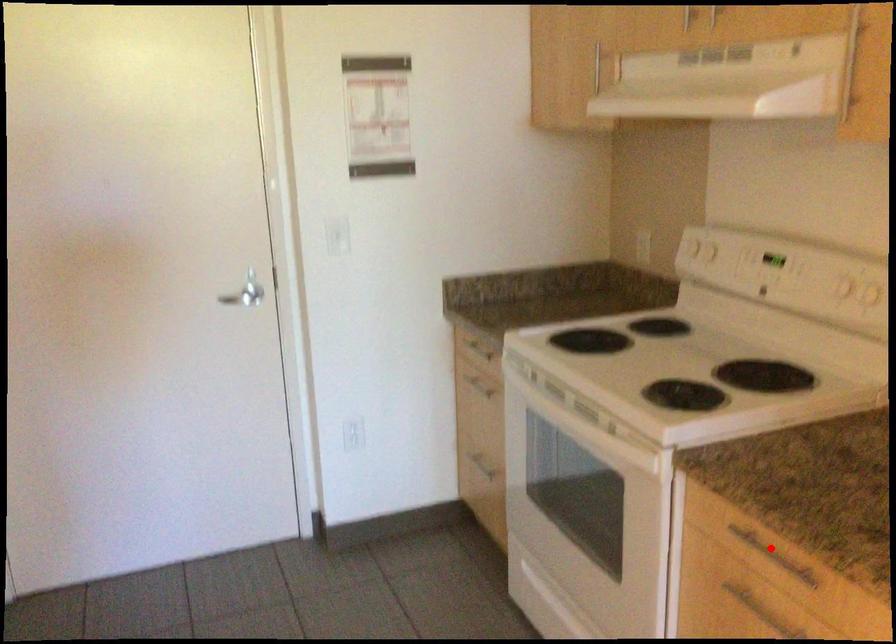
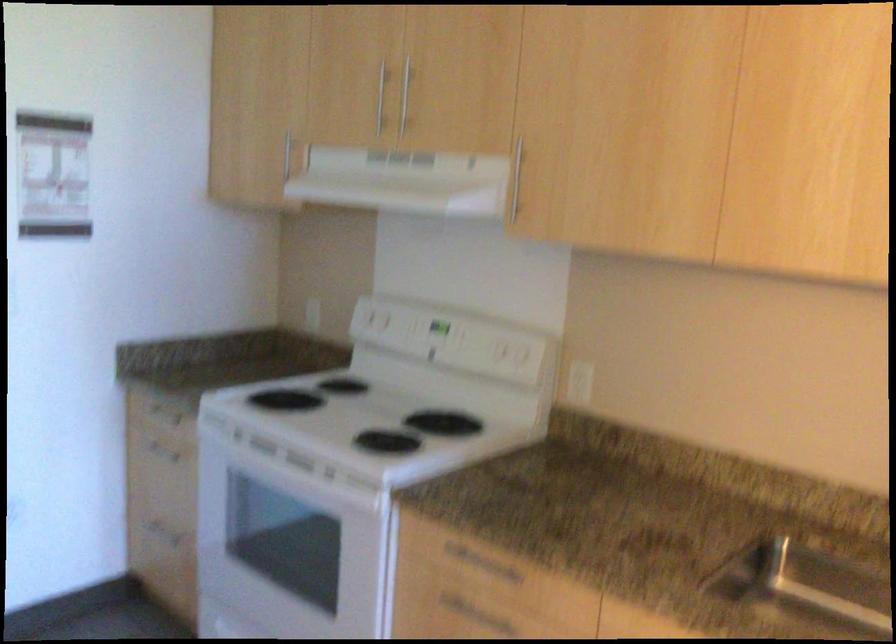
In the second image, find the point that corresponds to the highlighted location in the first image.

(480, 564)